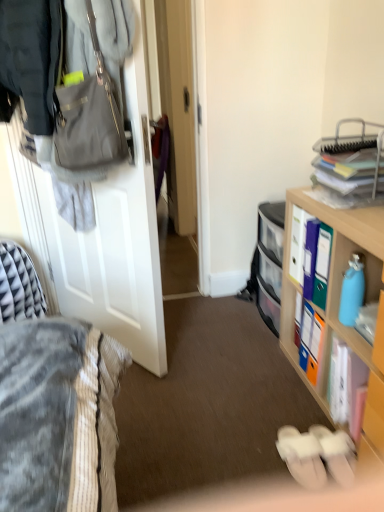
Identify the location of free space to the back side of white fabric slippers at lower center, the 2th footwear viewed from the right. (280, 413).